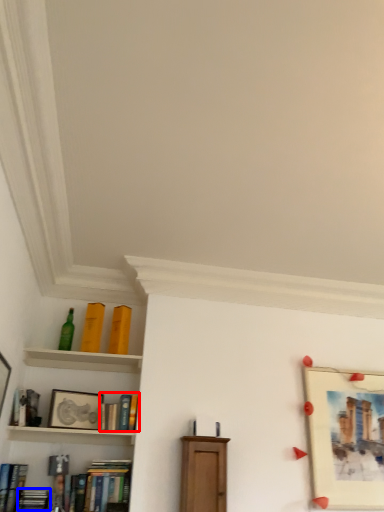
Question: Which object appears closest to the camera in this image, book (highlighted by a red box) or book (highlighted by a blue box)?

Choices:
 (A) book
 (B) book

Answer: (B)